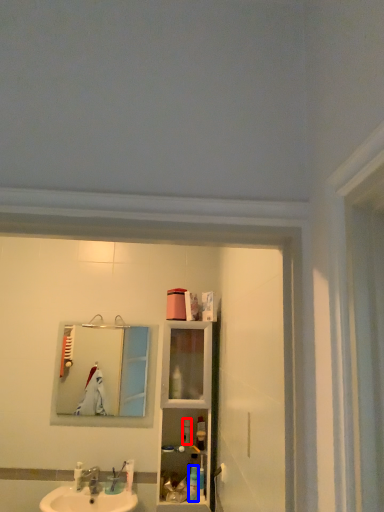
Question: Among these objects, which one is nearest to the camera, toiletry (highlighted by a red box) or toiletry (highlighted by a blue box)?

Choices:
 (A) toiletry
 (B) toiletry

Answer: (B)